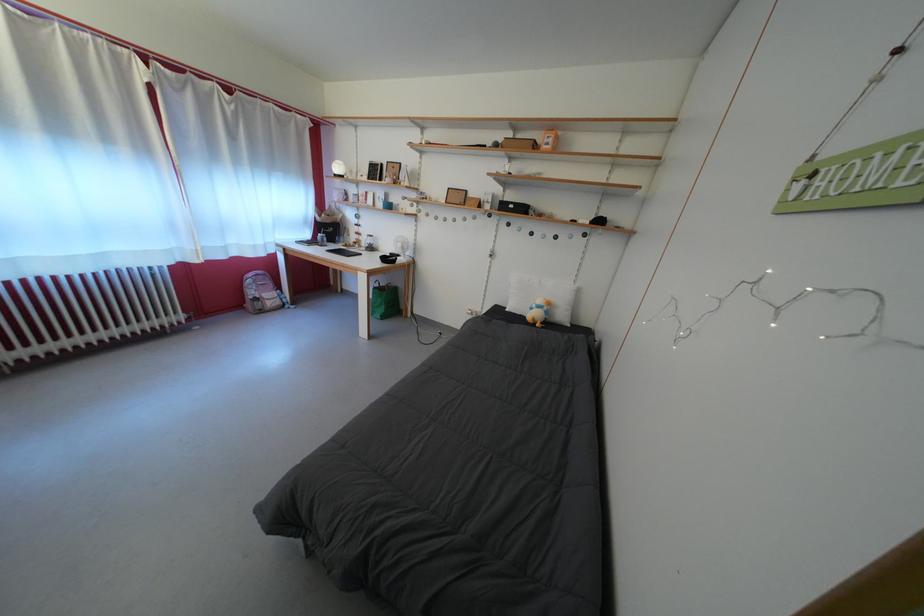
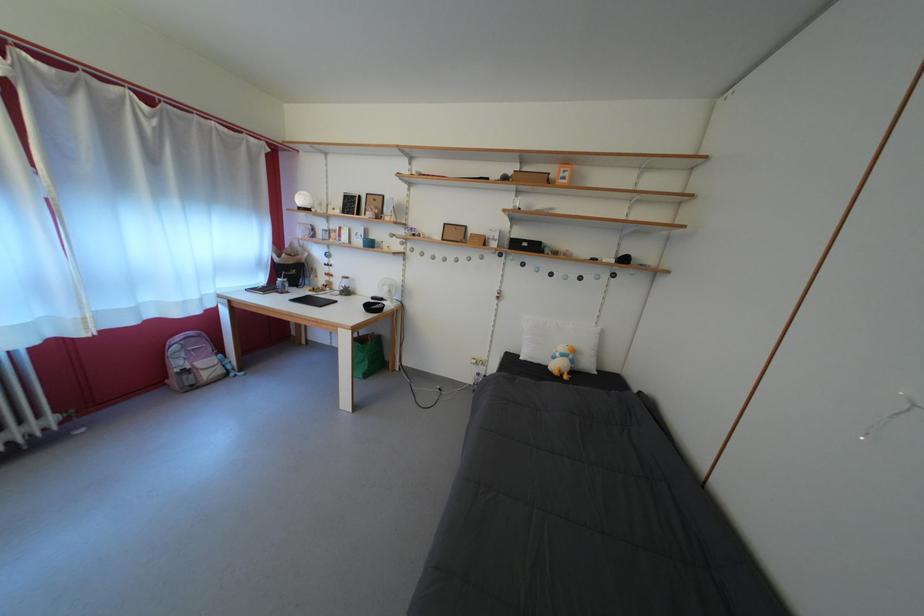
Question: The first image is from the beginning of the video and the second image is from the end. How did the camera likely rotate when shooting the video?

Choices:
 (A) Left
 (B) Right
 (C) Up
 (D) Down

Answer: (B)